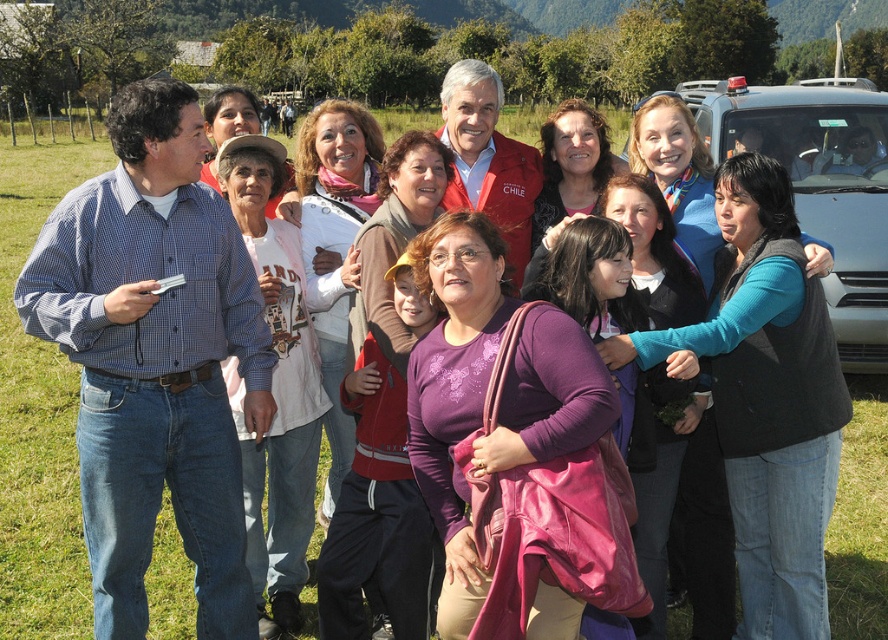
Question: Can you confirm if blue checkered shirt at left is positioned above metallic silver car at right?

Choices:
 (A) no
 (B) yes

Answer: (A)

Question: Is blue checkered shirt at left to the left of metallic silver car at right from the viewer's perspective?

Choices:
 (A) yes
 (B) no

Answer: (A)

Question: Which of the following is the closest to the observer?

Choices:
 (A) (738, 132)
 (B) (16, 296)

Answer: (B)

Question: Does blue checkered shirt at left come in front of metallic silver car at right?

Choices:
 (A) yes
 (B) no

Answer: (A)

Question: Among these objects, which one is farthest from the camera?

Choices:
 (A) blue checkered shirt at left
 (B) metallic silver car at right

Answer: (B)

Question: Which point is closer to the camera?

Choices:
 (A) (236, 628)
 (B) (811, 102)

Answer: (A)